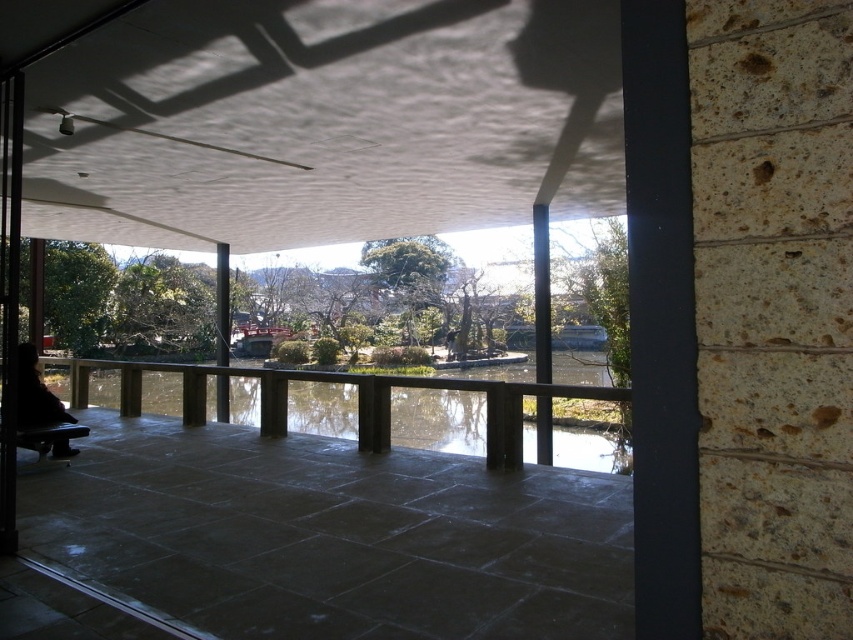
You are an architect designing a new building and want to ensure that the white textured ceiling at upper center and the transparent glass water at center are proportionally balanced. Based on the scene provided, which object has a narrower width?

The white textured ceiling at upper center has a lesser width compared to the transparent glass water at center, so the white textured ceiling at upper center is narrower in width.

You are an interior designer planning to install a large chandelier that requires a minimum of 6 meters of clearance from the ceiling to the floor. Based on the scene, can the white textured ceiling at upper center accommodate this chandelier?

The white textured ceiling at upper center is 6.86 meters from the camera, which exceeds the required 6 meters clearance. Therefore, the chandelier can be installed there.

You are a drone operator planning to fly a drone from the white textured ceiling at upper center to the transparent glass water at center. According to the scene description, what is the approximate distance you need to cover in feet?

The white textured ceiling at upper center and transparent glass water at center are 24.79 feet apart from each other, so the approximate distance to cover is 24.79 feet.